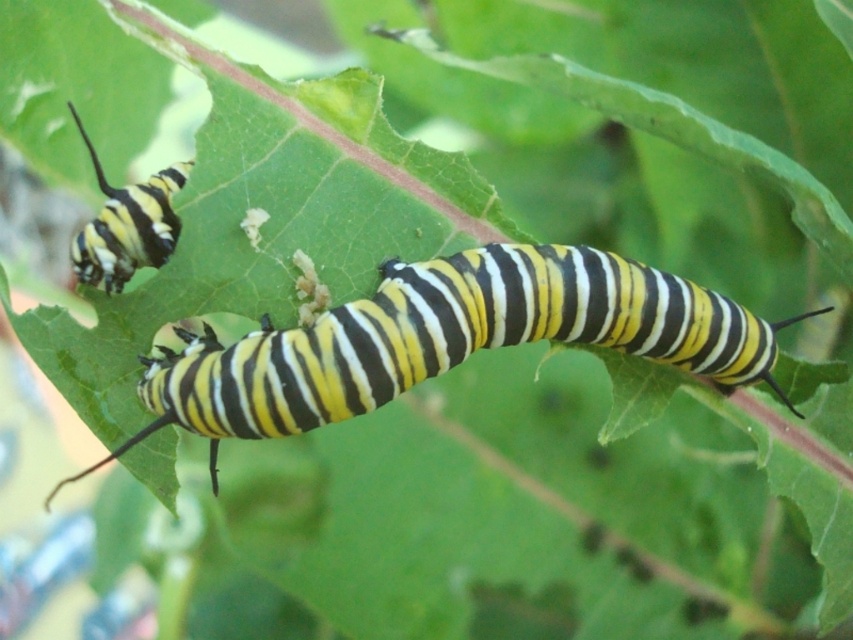
Question: Does yellow-black-striped caterpillar at center have a larger size compared to yellow striped caterpillar at upper left?

Choices:
 (A) yes
 (B) no

Answer: (A)

Question: Which point is farther to the camera?

Choices:
 (A) yellow striped caterpillar at upper left
 (B) yellow-black-striped caterpillar at center

Answer: (A)

Question: Does yellow-black-striped caterpillar at center have a greater width compared to yellow striped caterpillar at upper left?

Choices:
 (A) yes
 (B) no

Answer: (A)

Question: Which point is farther from the camera taking this photo?

Choices:
 (A) (480, 305)
 (B) (112, 204)

Answer: (A)

Question: Is yellow-black-striped caterpillar at center above yellow striped caterpillar at upper left?

Choices:
 (A) no
 (B) yes

Answer: (A)